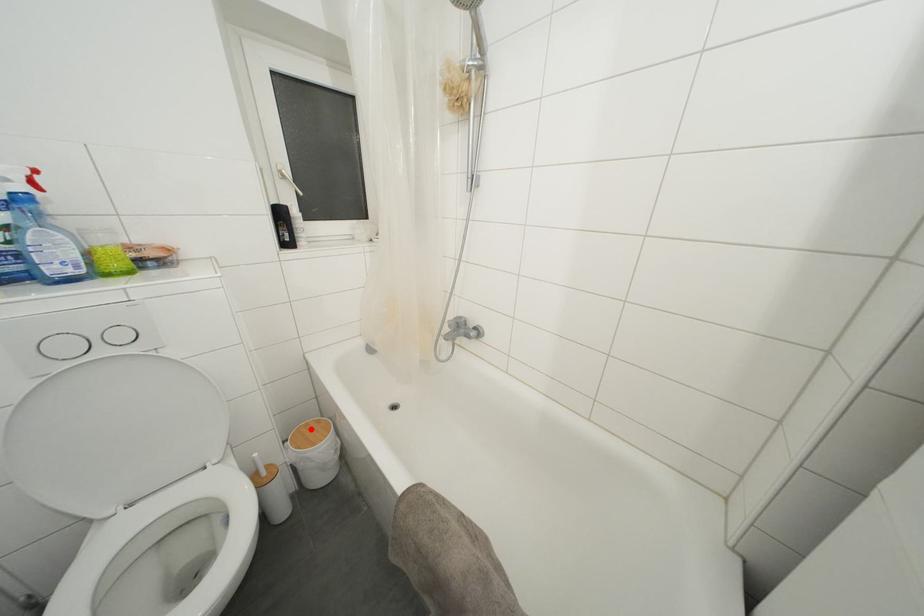
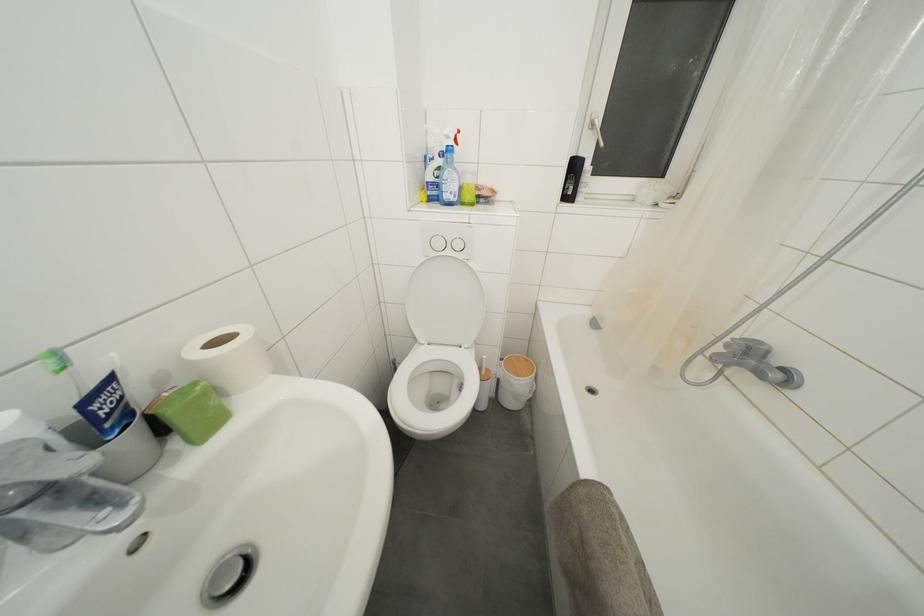
Question: A red point is marked in image1. In image2, is the corresponding 3D point closer to the camera or farther? Reply with the corresponding letter.

Choices:
 (A) The corresponding 3D point is closer.
 (B) The corresponding 3D point is farther.

Answer: (A)